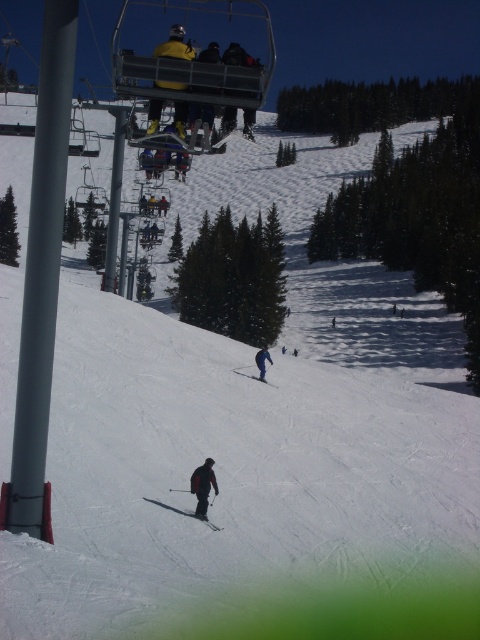
You are a photographer standing at the base of the slope and want to take a photo of the dark gray ski suit at lower center and the black matte ski at lower center. Which object will appear closer to you in the photo?

The dark gray ski suit at lower center will appear closer to you in the photo because it is positioned further to the viewer than the black matte ski at lower center.

You are a photographer planning to capture a closeup shot of the dark gray ski suit at lower center and the black matte ski at lower center. Which object should you focus on first if you want to ensure both are in focus without adjusting the camera settings?

The dark gray ski suit at lower center has a smaller size compared to the black matte ski at lower center, so focusing on the larger black matte ski at lower center first would help ensure both objects are in focus since it requires a smaller depth of field adjustment.